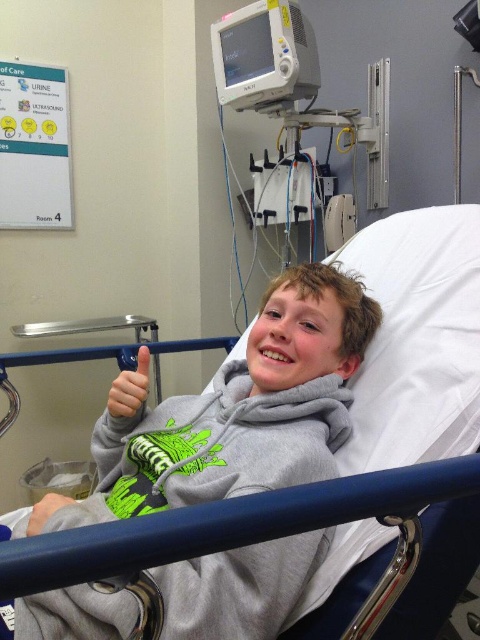
Question: Does gray matte hoodie at center have a larger size compared to matte gray glove at lower left?

Choices:
 (A) yes
 (B) no

Answer: (A)

Question: Can you confirm if gray matte hoodie at center is smaller than matte gray glove at lower left?

Choices:
 (A) no
 (B) yes

Answer: (A)

Question: Estimate the real-world distances between objects in this image. Which object is closer to the white plastic monitor at upper center?

Choices:
 (A) gray fabric hand at lower left
 (B) gray matte hoodie at center

Answer: (B)

Question: Which of the following is the closest to the observer?

Choices:
 (A) matte gray glove at lower left
 (B) white plastic monitor at upper center

Answer: (A)

Question: Is white plastic monitor at upper center bigger than gray fabric hand at lower left?

Choices:
 (A) yes
 (B) no

Answer: (A)

Question: Estimate the real-world distances between objects in this image. Which object is farther from the white plastic monitor at upper center?

Choices:
 (A) gray matte hoodie at center
 (B) gray fabric hand at lower left

Answer: (B)